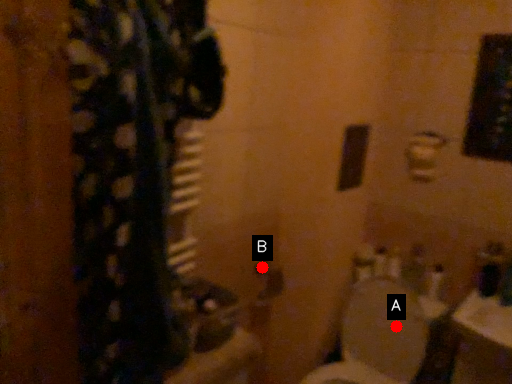
Question: Two points are circled on the image, labeled by A and B beside each circle. Which point appears farthest from the camera in this image?

Choices:
 (A) A is further
 (B) B is further

Answer: (B)